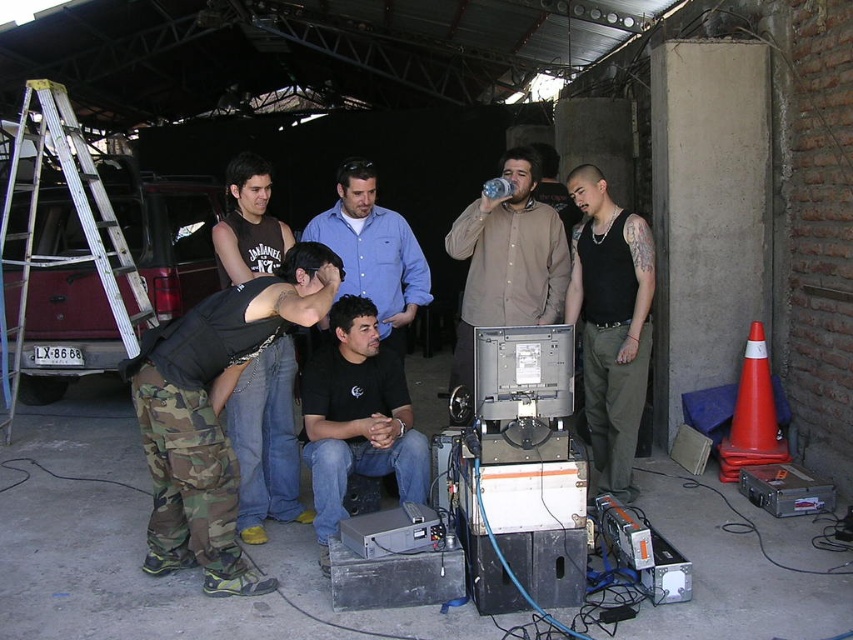
Question: Which point appears farthest from the camera in this image?

Choices:
 (A) [x=71, y=189]
 (B) [x=300, y=321]
 (C) [x=613, y=323]
 (D) [x=360, y=348]

Answer: (A)

Question: Can you confirm if camo pants at center is positioned to the left of black tank top at center?

Choices:
 (A) no
 (B) yes

Answer: (B)

Question: Can you confirm if black matte shirt at center is thinner than silver metallic ladder at left?

Choices:
 (A) yes
 (B) no

Answer: (A)

Question: Which point is farther from the camera taking this photo?

Choices:
 (A) (254, 307)
 (B) (25, 264)

Answer: (B)

Question: Which point appears closest to the camera in this image?

Choices:
 (A) (389, 260)
 (B) (279, 509)
 (C) (221, 509)
 (D) (128, 260)

Answer: (C)

Question: Considering the relative positions of black tank top at center and black leather vest at center in the image provided, where is black tank top at center located with respect to black leather vest at center?

Choices:
 (A) right
 (B) left

Answer: (A)